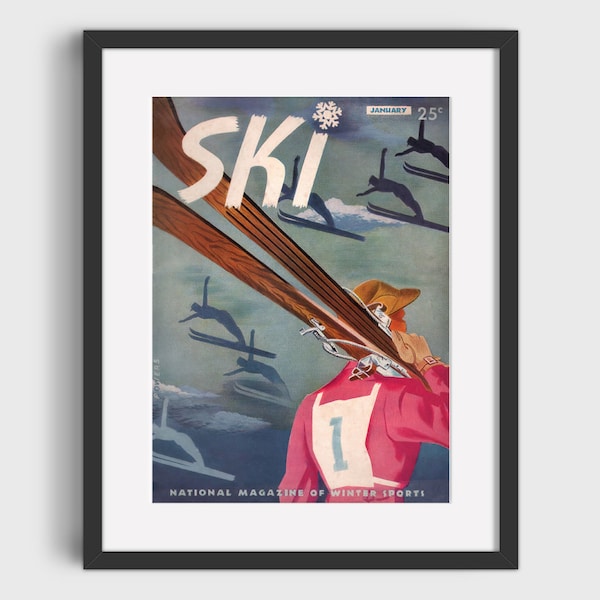
Where is `frame of the picture`? The height and width of the screenshot is (600, 600). frame of the picture is located at coordinates (508, 253), (87, 273), (319, 557), (335, 38).